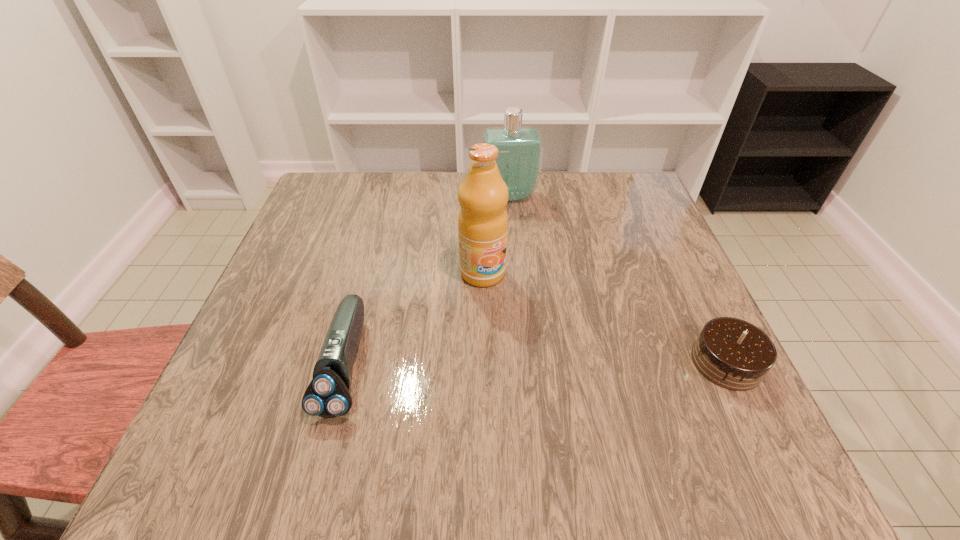
Image resolution: width=960 pixels, height=540 pixels. Find the location of `vacant space on the desktop that is between the electric shaver and the rightmost object and is positioned on the front label of the perfume`. vacant space on the desktop that is between the electric shaver and the rightmost object and is positioned on the front label of the perfume is located at coordinates (542, 363).

Where is `vacant space on the desktop that is between the electric shaver and the rightmost object and is positioned on the front label of the fruit juice`? vacant space on the desktop that is between the electric shaver and the rightmost object and is positioned on the front label of the fruit juice is located at coordinates (554, 363).